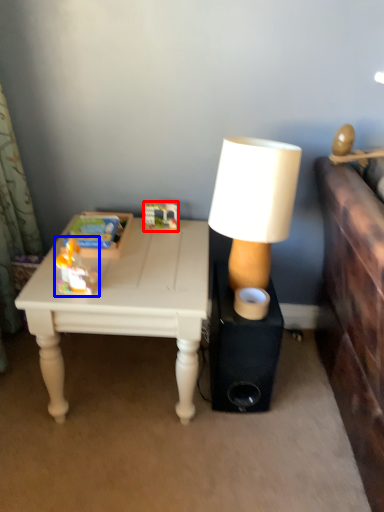
Question: Which object appears farthest to the camera in this image, toy (highlighted by a red box) or toy (highlighted by a blue box)?

Choices:
 (A) toy
 (B) toy

Answer: (A)